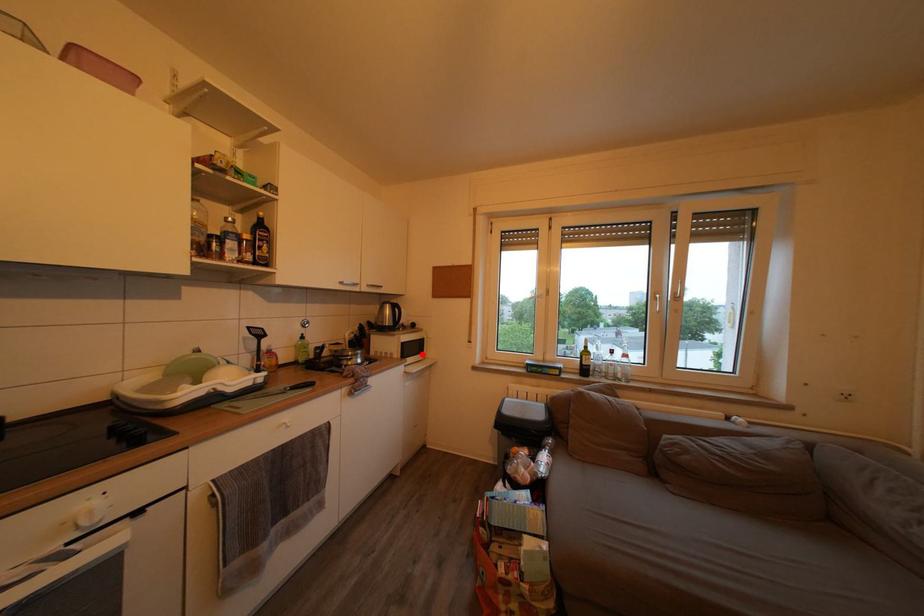
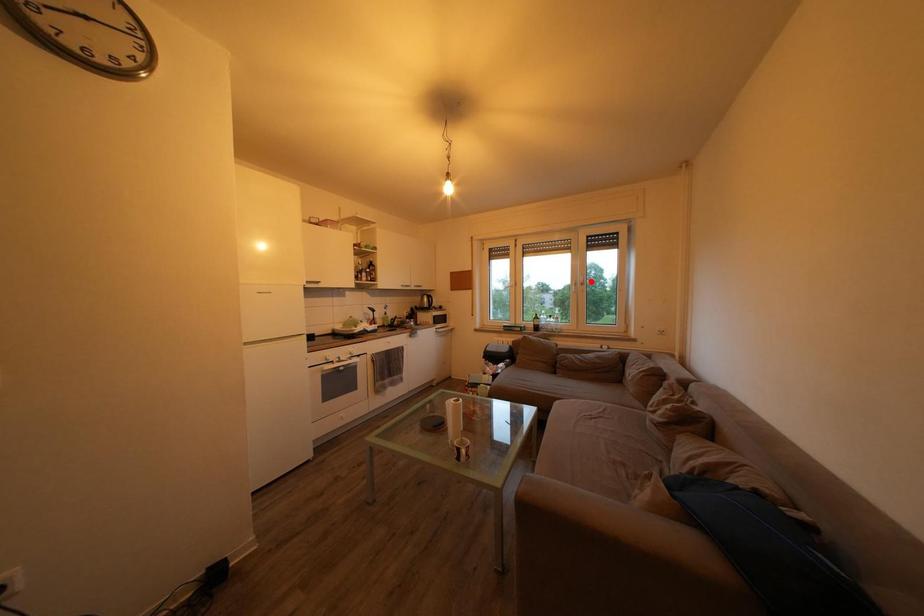
I am providing you with two images of the same scene from different viewpoints. A red point is marked on the first image and another point is marked on the second image. Do the highlighted points in image1 and image2 indicate the same real-world spot?

No